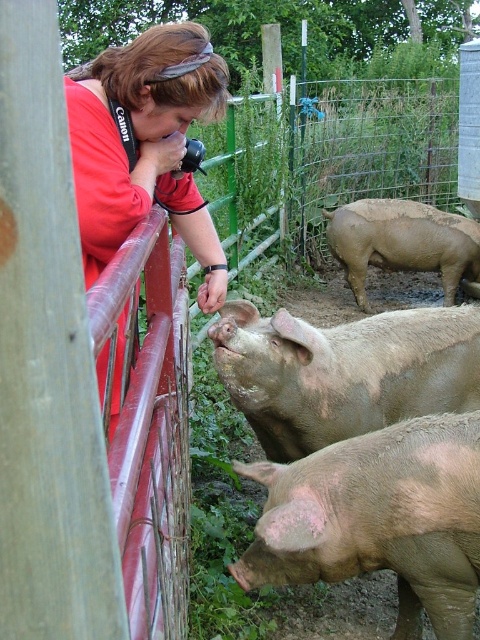
You are a farmer who needs to identify which pig is more likely to need additional feed based on their body condition. Which pig between the brown matte pig at lower right and the light brown muddy pig at center should you prioritize?

The brown matte pig at lower right is thinner than the light brown muddy pig at center, so you should prioritize feeding the brown matte pig at lower right.

You are standing at the center of the image and want to take a photo of the brown matte pig at lower right. In which direction should you move to get a better shot?

The brown matte pig at lower right is located at coordinates 0.811 on the x axis and 0.790 on the y axis. Since you are at the center, you should move towards the lower right direction to get a better shot of the brown matte pig at lower right.